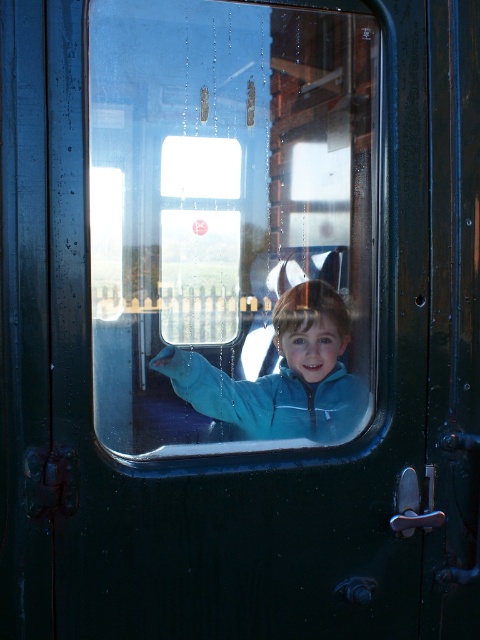
Is transparent glass train window at center positioned behind blue fleece jacket at center?

No.

Does transparent glass train window at center appear on the left side of blue fleece jacket at center?

Yes, transparent glass train window at center is to the left of blue fleece jacket at center.

You are a GUI agent. You are given a task and a screenshot of the screen. Output one action in this format:
    pyautogui.click(x=<x>, y=<y>)
    Task: Click on the transparent glass train window at center
    This screenshot has height=640, width=480.
    Given the screenshot: What is the action you would take?
    pyautogui.click(x=229, y=225)